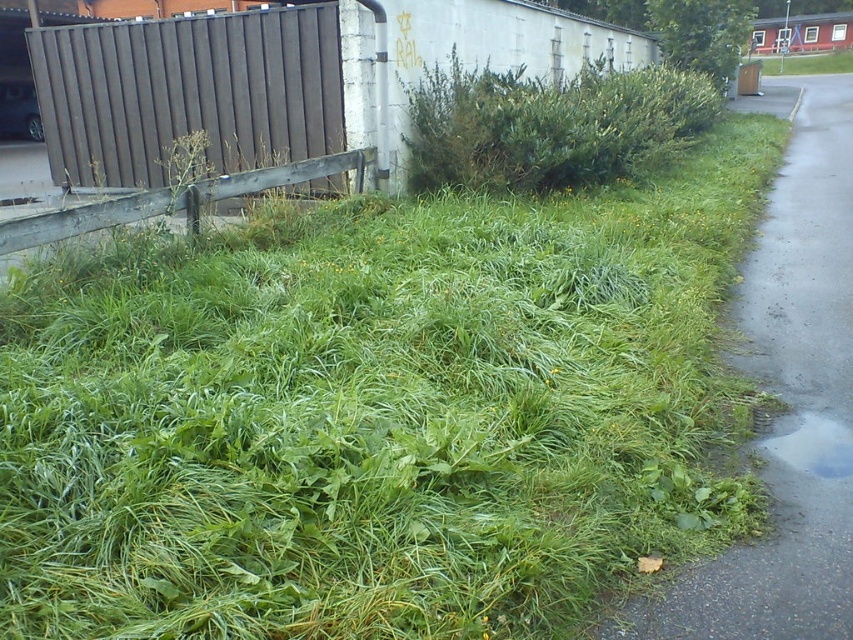
Is green leafy bush at upper center to the right of green grass at right from the viewer's perspective?

No, green leafy bush at upper center is not to the right of green grass at right.

Is point (556, 163) less distant than point (792, 106)?

That is True.

Locate an element on the screen. Image resolution: width=853 pixels, height=640 pixels. green leafy bush at upper center is located at coordinates (550, 125).

What do you see at coordinates (787, 401) in the screenshot?
I see `gray asphalt pavement at lower right` at bounding box center [787, 401].

Is point (775, 545) positioned in front of point (141, 61)?

Yes, it is.

What are the coordinates of `gray asphalt pavement at lower right` in the screenshot? It's located at (787, 401).

Consider the image. Between gray asphalt pavement at lower right and wooden fence at left, which one has less height?

gray asphalt pavement at lower right is shorter.

Is point (720, 618) closer to camera compared to point (15, 253)?

Yes, it is.

What are the coordinates of `gray asphalt pavement at lower right` in the screenshot? It's located at (787, 401).